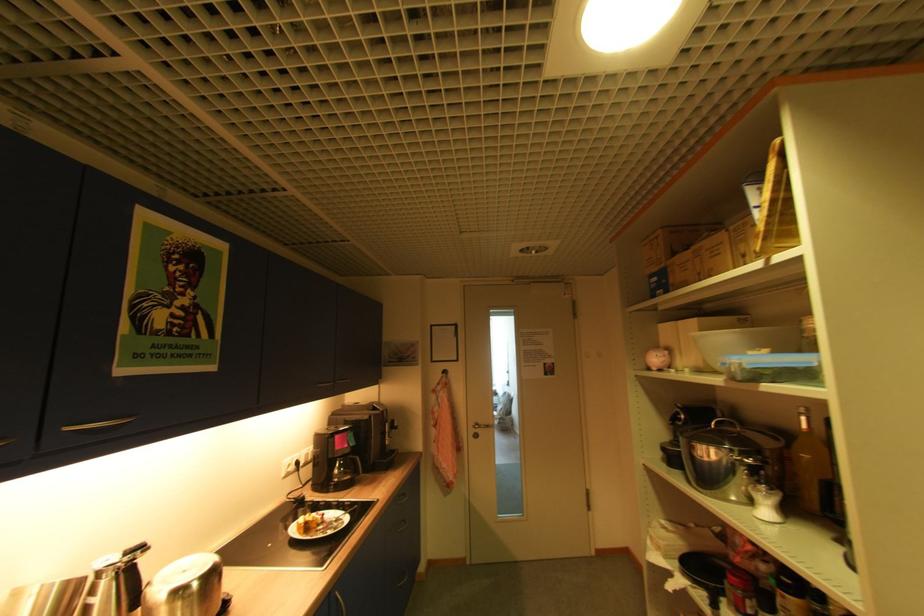
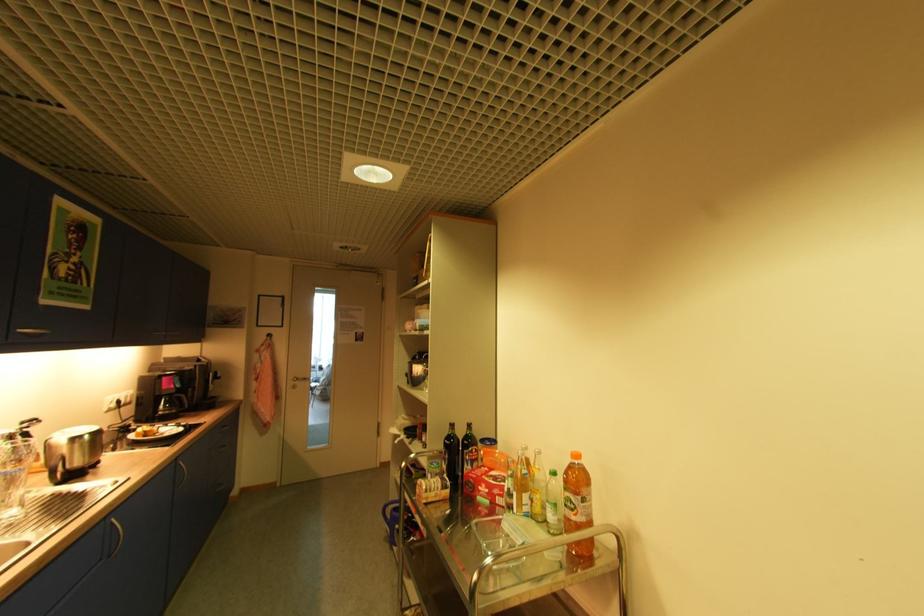
The point at (354,451) is marked in the first image. Where is the corresponding point in the second image?

(178, 392)